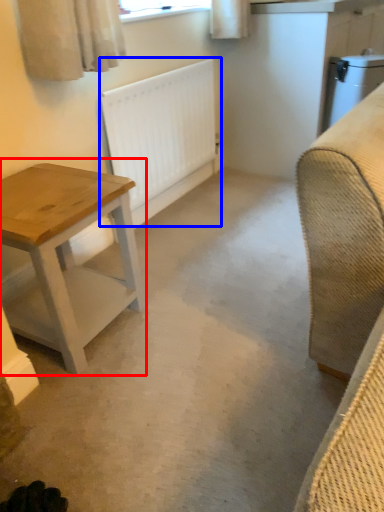
Question: Which object appears closest to the camera in this image, table (highlighted by a red box) or radiator (highlighted by a blue box)?

Choices:
 (A) table
 (B) radiator

Answer: (A)